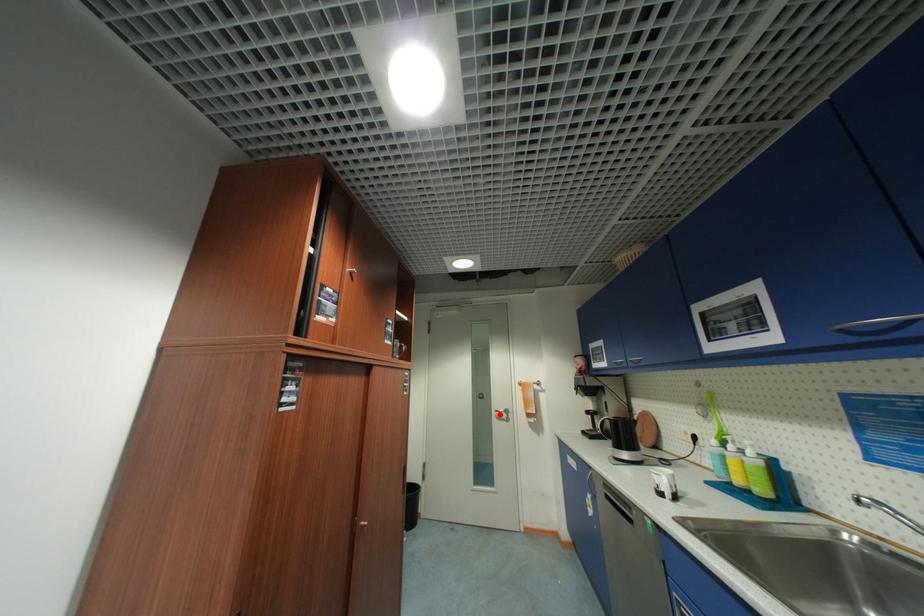
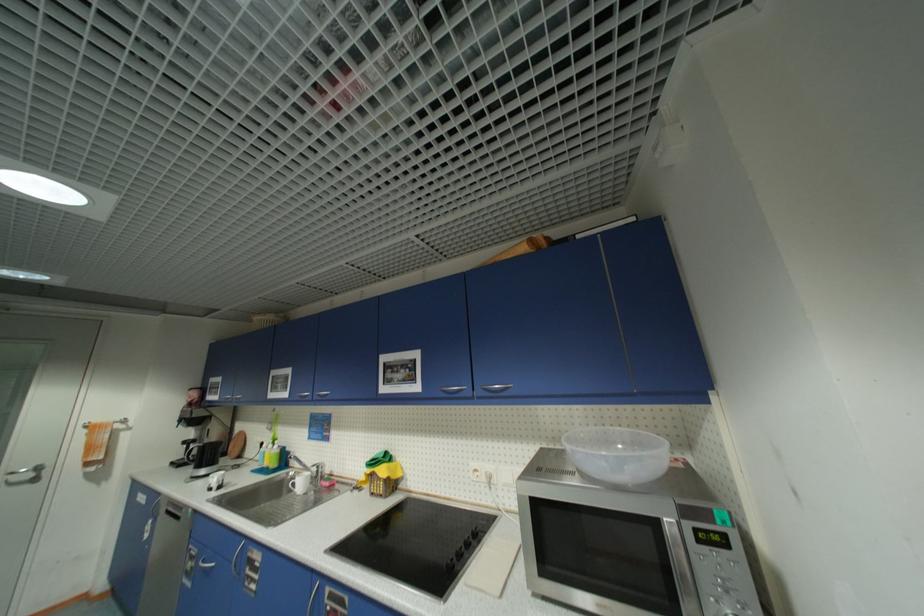
In the second image, find the point that corresponds to the highlighted location in the first image.

(7, 479)